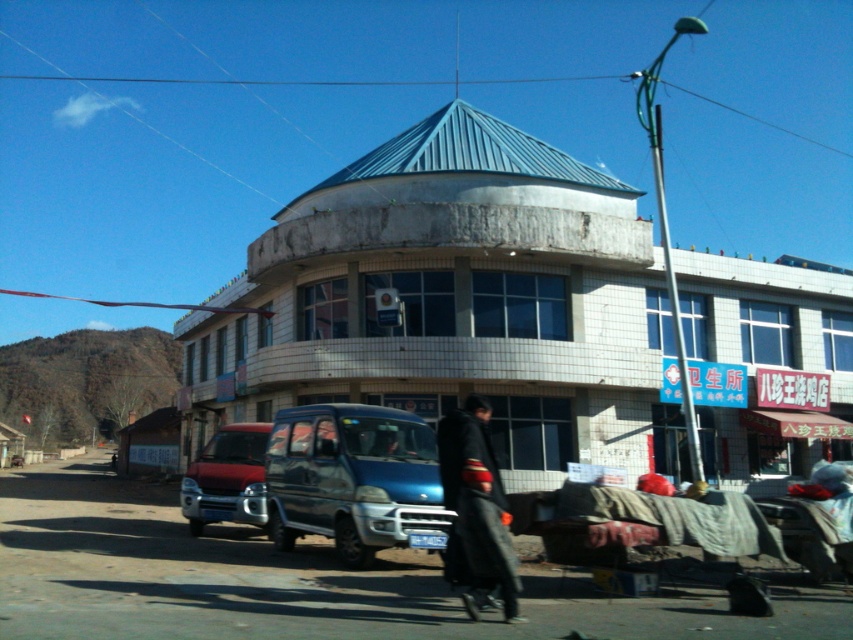
Based on the photo, does blue metallic van at center have a larger size compared to black matte robe at center?

Actually, blue metallic van at center might be smaller than black matte robe at center.

Is blue metallic van at center smaller than black matte robe at center?

Yes, blue metallic van at center is smaller than black matte robe at center.

Is point (271, 438) farther from viewer compared to point (476, 444)?

Yes, point (271, 438) is farther from viewer.

At what (x,y) coordinates should I click in order to perform the action: click on blue metallic van at center. Please return your answer as a coordinate pair (x, y). Image resolution: width=853 pixels, height=640 pixels. Looking at the image, I should click on click(x=354, y=480).

Can you confirm if matte red van at center is positioned to the left of black matte robe at center?

Yes, matte red van at center is to the left of black matte robe at center.

Consider the image. Does matte red van at center come in front of black matte robe at center?

No, it is not.

Who is more distant from viewer, (258,472) or (496,605)?

The point (258,472) is more distant.

Locate an element on the screen. The image size is (853, 640). matte red van at center is located at coordinates (227, 477).

Based on the photo, is blue metallic van at center in front of matte red van at center?

Yes, blue metallic van at center is closer to the viewer.

Between point (292, 508) and point (195, 497), which one is positioned in front?

Positioned in front is point (292, 508).

Which is behind, point (321, 412) or point (210, 513)?

Point (210, 513)

The width and height of the screenshot is (853, 640). In order to click on blue metallic van at center in this screenshot , I will do `click(354, 480)`.